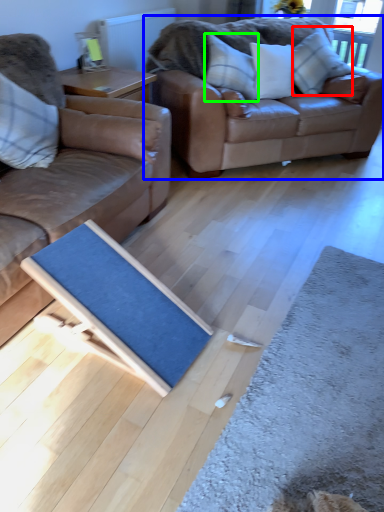
Question: Which is nearer to the pillow (highlighted by a red box)? studio couch (highlighted by a blue box) or pillow (highlighted by a green box).

Choices:
 (A) studio couch
 (B) pillow

Answer: (A)